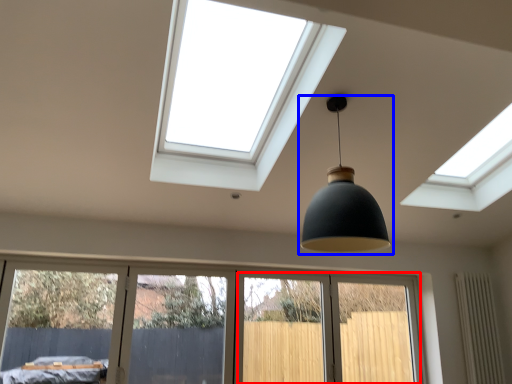
Question: Which of the following is the closest to the observer, screen door (highlighted by a red box) or lamp (highlighted by a blue box)?

Choices:
 (A) screen door
 (B) lamp

Answer: (B)